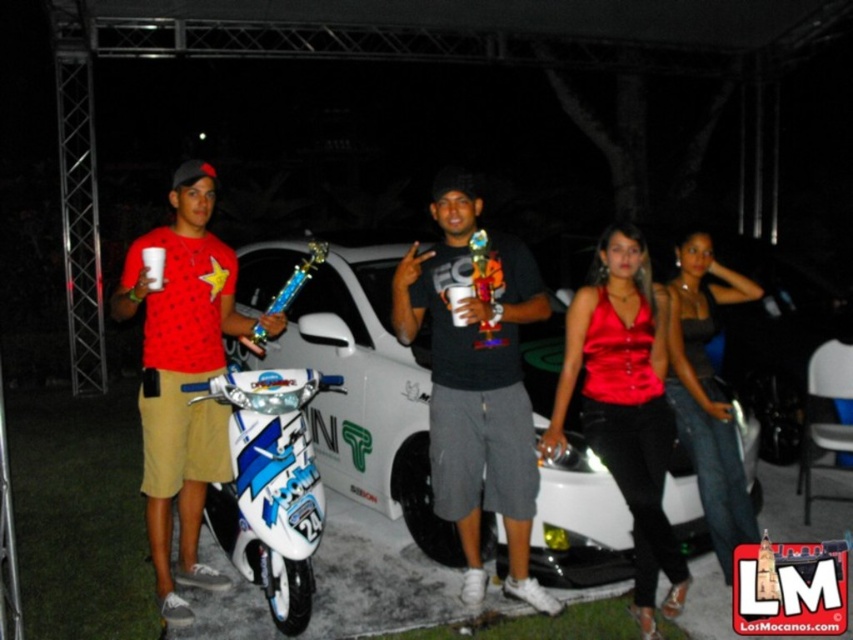
Question: Does white glossy motorcycle at center appear over denim jeans at center?

Choices:
 (A) yes
 (B) no

Answer: (B)

Question: Can you confirm if matte black t-shirt at center is thinner than matte red t-shirt at center?

Choices:
 (A) yes
 (B) no

Answer: (B)

Question: Does matte black t-shirt at center have a lesser width compared to white glossy motorcycle at center?

Choices:
 (A) no
 (B) yes

Answer: (B)

Question: Which is nearer to the matte black t-shirt at center?

Choices:
 (A) matte red t-shirt at center
 (B) shiny satin top at center
 (C) white glossy motorcycle at center

Answer: (B)

Question: Which of the following is the farthest from the observer?

Choices:
 (A) (556, 609)
 (B) (703, 480)

Answer: (B)

Question: Which point is farther to the camera?

Choices:
 (A) (718, 268)
 (B) (645, 477)
 (C) (445, 202)

Answer: (A)